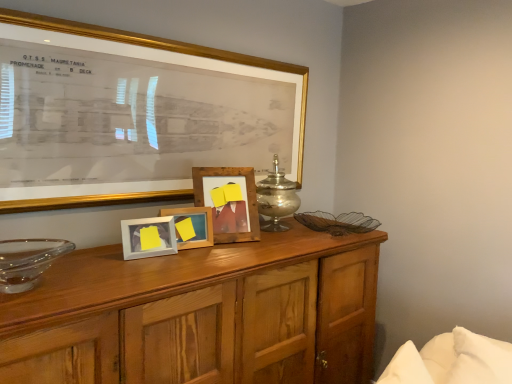
At what (x,y) coordinates should I click in order to perform the action: click on free space in front of white matte picture frame at center, which appears as the 2th picture frame when viewed from the front. Please return your answer as a coordinate pair (x, y). This screenshot has height=384, width=512. Looking at the image, I should click on (136, 263).